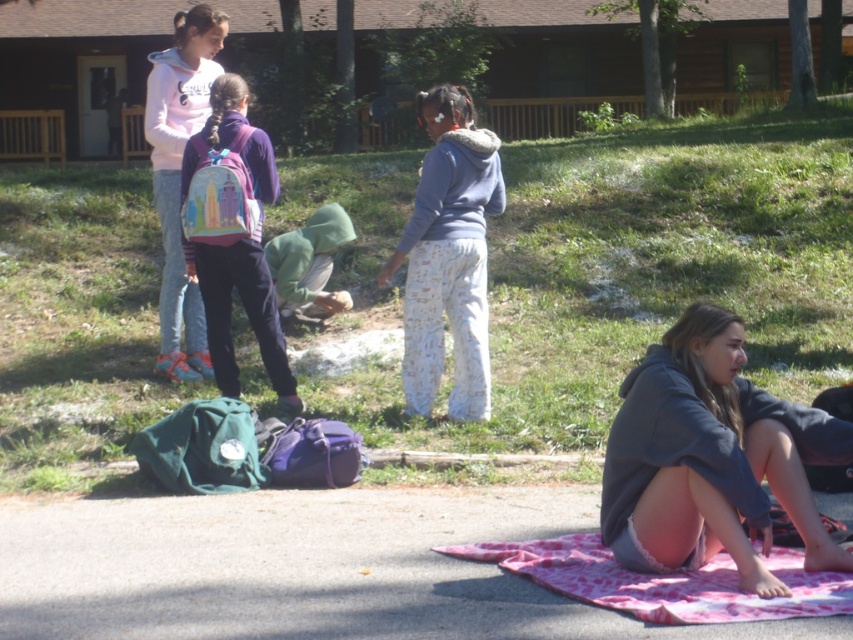
You are a photographer trying to capture the scene with the green grass at center and the matte pink backpack at upper left. Which object is closer to the camera based on their positions?

The matte pink backpack at upper left is closer to the camera because it is positioned above the green grass at center, which is located beneath it.